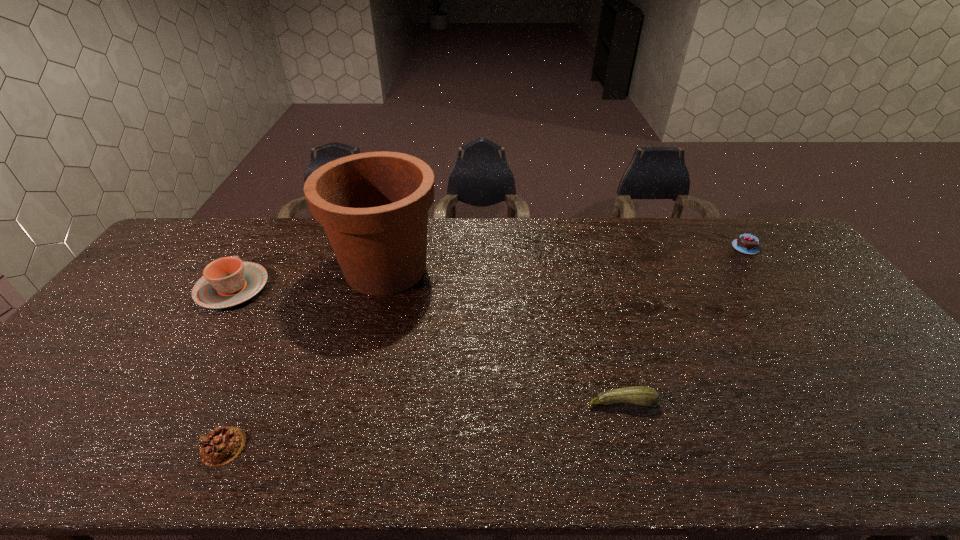
You are a GUI agent. You are given a task and a screenshot of the screen. Output one action in this format:
    pyautogui.click(x=<x>, y=<y>)
    Task: Click on the object that is at the right edge
    The image size is (960, 540).
    Given the screenshot: What is the action you would take?
    pyautogui.click(x=746, y=243)

Find the location of `object situated at the far right corner`. object situated at the far right corner is located at coordinates (746, 243).

Locate an element on the screen. vacant space at the far edge of the desktop is located at coordinates (488, 238).

I want to click on free space at the right edge of the desktop, so click(836, 326).

Image resolution: width=960 pixels, height=540 pixels. In order to click on free spot between the left chocolate cake and the right chocolate cake in this screenshot , I will do `click(485, 347)`.

This screenshot has height=540, width=960. What are the coordinates of `vacant region between the tallest object and the fourth object from right to left` in the screenshot? It's located at (304, 357).

Identify the location of free spot between the chinaware and the fourth object from left to right. This screenshot has width=960, height=540. (427, 345).

In order to click on free space between the third object from right to left and the nearer chocolate cake in this screenshot , I will do `click(304, 357)`.

Where is `blank region between the tallest object and the zucchini`? The image size is (960, 540). blank region between the tallest object and the zucchini is located at coordinates (504, 335).

You are a GUI agent. You are given a task and a screenshot of the screen. Output one action in this format:
    pyautogui.click(x=<x>, y=<y>)
    Task: Click on the free space between the rightmost object and the tallest object
    
    Given the screenshot: What is the action you would take?
    pyautogui.click(x=565, y=258)